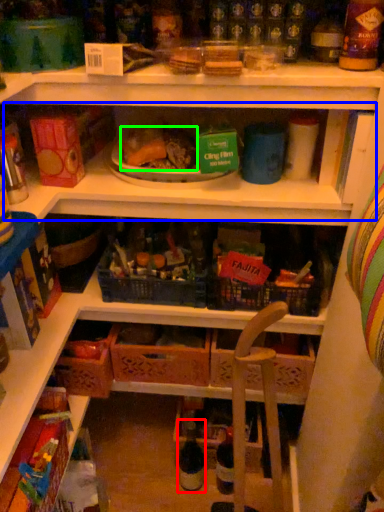
Question: Which is farther away from bottle (highlighted by a red box)? shelf (highlighted by a blue box) or food (highlighted by a green box)?

Choices:
 (A) shelf
 (B) food

Answer: (B)